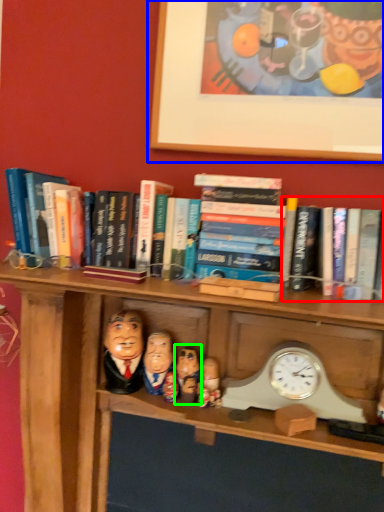
Question: Considering the real-world distances, which object is farthest from book (highlighted by a red box)? picture frame (highlighted by a blue box) or person (highlighted by a green box)?

Choices:
 (A) picture frame
 (B) person

Answer: (B)